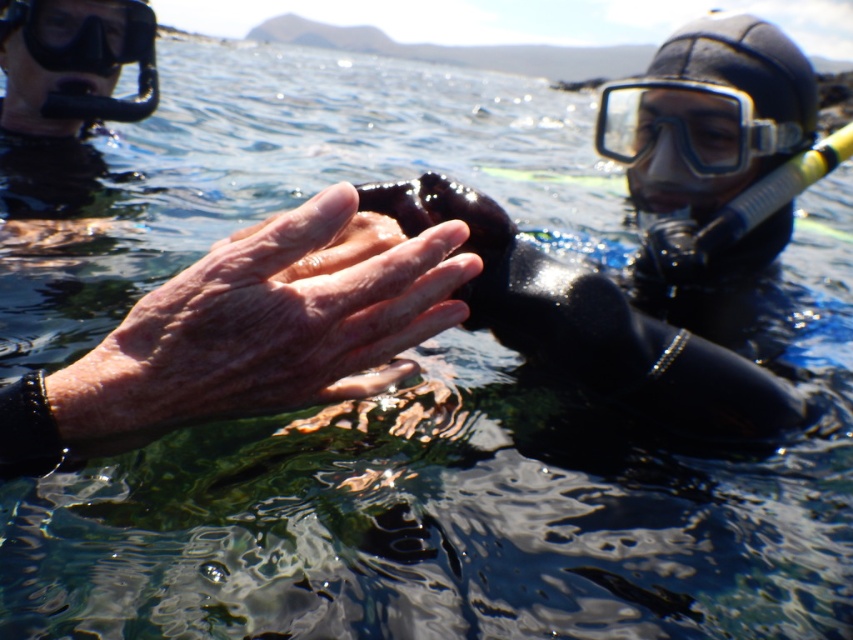
You are a marine biologist observing two divers underwater. You notice the clear plastic goggles at upper right and the black matte goggles at upper left. Which pair of goggles is located to the right of the other?

The clear plastic goggles at upper right is positioned on the right side of black matte goggles at upper left.

You are a marine biologist observing two divers underwater. You have a tool that requires both pairs of goggles to be within 1 meter to operate. Are the clear plastic goggles at upper right and black matte goggles at upper left close enough to use the tool?

The clear plastic goggles at upper right and black matte goggles at upper left are 1.09 meters apart from each other. Since the required distance for the tool is 1 meter, they are slightly too far apart to use the tool effectively.

You are a marine biologist observing two points in the water while underwater. The points are labeled as point 1 and point 2. You need to determine which point is closer to your current position. The points are located at coordinates point 1 at (346, 314) and point 2 at (724, 116). Based on the scene description, which point is closer to you?

Point 1 at (346, 314) is closer to the camera than point 2 at (724, 116), so point 1 is closer to your current position.